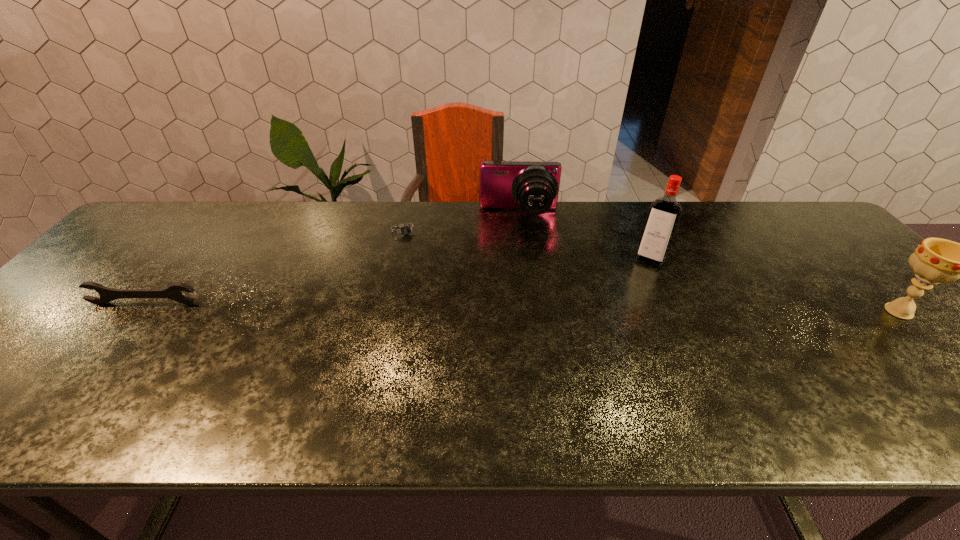
Identify the location of vacant area situated on the open ends of the wrench. The height and width of the screenshot is (540, 960). (90, 370).

This screenshot has height=540, width=960. In order to click on vacant space situated 0.050m on the back of the rightmost object in this screenshot , I will do `click(871, 284)`.

You are a GUI agent. You are given a task and a screenshot of the screen. Output one action in this format:
    pyautogui.click(x=<x>, y=<y>)
    Task: Click on the vacant point located 0.350m on the front and back of the vodka
    The height and width of the screenshot is (540, 960).
    Given the screenshot: What is the action you would take?
    pyautogui.click(x=600, y=349)

Locate an element on the screen. Image resolution: width=960 pixels, height=540 pixels. vacant area located on the front and back of the vodka is located at coordinates (606, 338).

I want to click on vacant space located 0.080m on the front and back of the vodka, so click(636, 282).

Locate an element on the screen. The width and height of the screenshot is (960, 540). free region located on the face of the fourth object from right to left is located at coordinates (450, 333).

The height and width of the screenshot is (540, 960). I want to click on vacant area situated on the face of the fourth object from right to left, so click(415, 252).

You are a GUI agent. You are given a task and a screenshot of the screen. Output one action in this format:
    pyautogui.click(x=<x>, y=<y>)
    Task: Click on the vacant space located 0.340m on the face of the fourth object from right to left
    This screenshot has width=960, height=540.
    Given the screenshot: What is the action you would take?
    pyautogui.click(x=445, y=321)

Image resolution: width=960 pixels, height=540 pixels. I want to click on vacant region located on the front-facing side of the third tallest object, so click(x=523, y=309).

I want to click on vacant space located 0.090m on the front-facing side of the third tallest object, so click(519, 244).